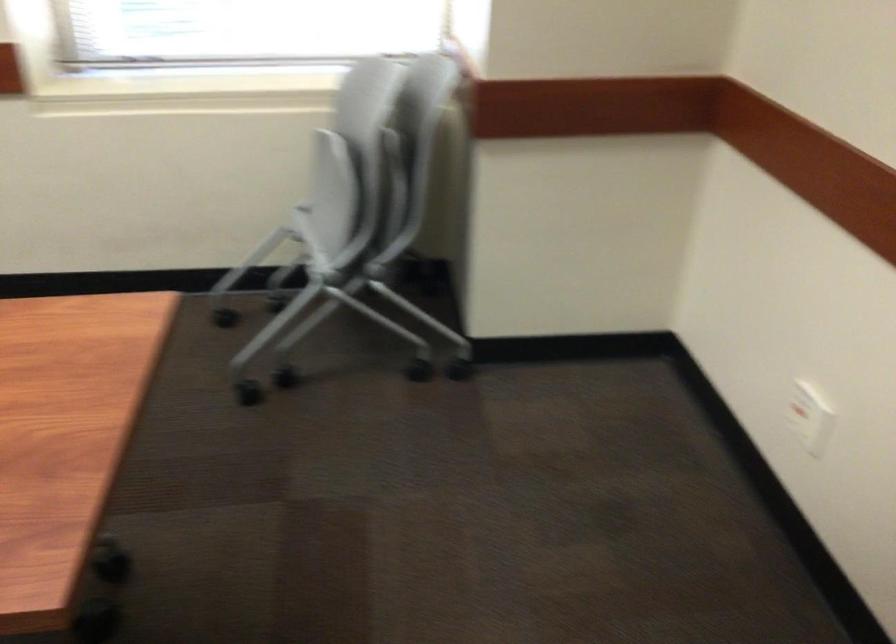
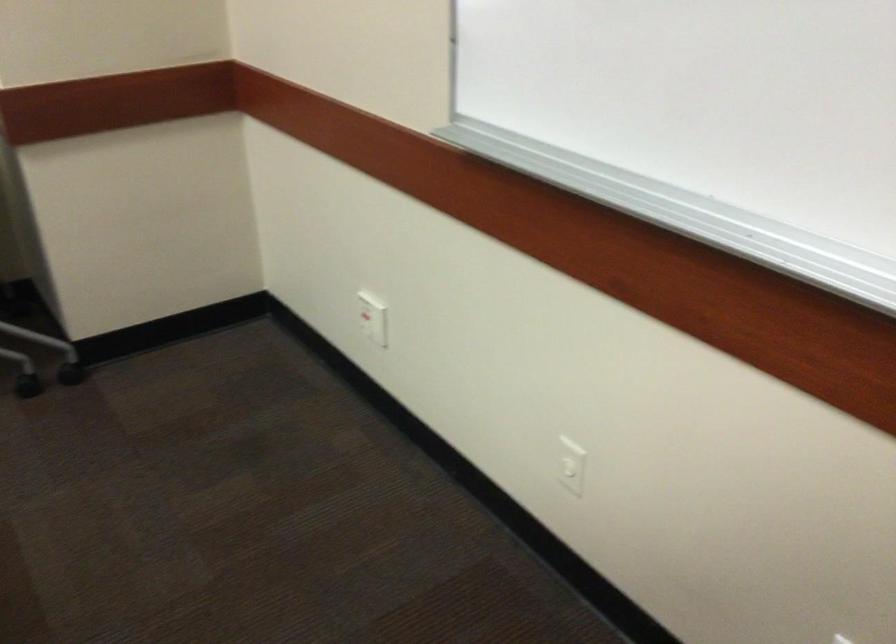
Question: The camera is either moving clockwise (left) or counter-clockwise (right) around the object. The first image is from the beginning of the video and the second image is from the end. Is the camera moving left or right when shooting the video?

Choices:
 (A) Left
 (B) Right

Answer: (A)